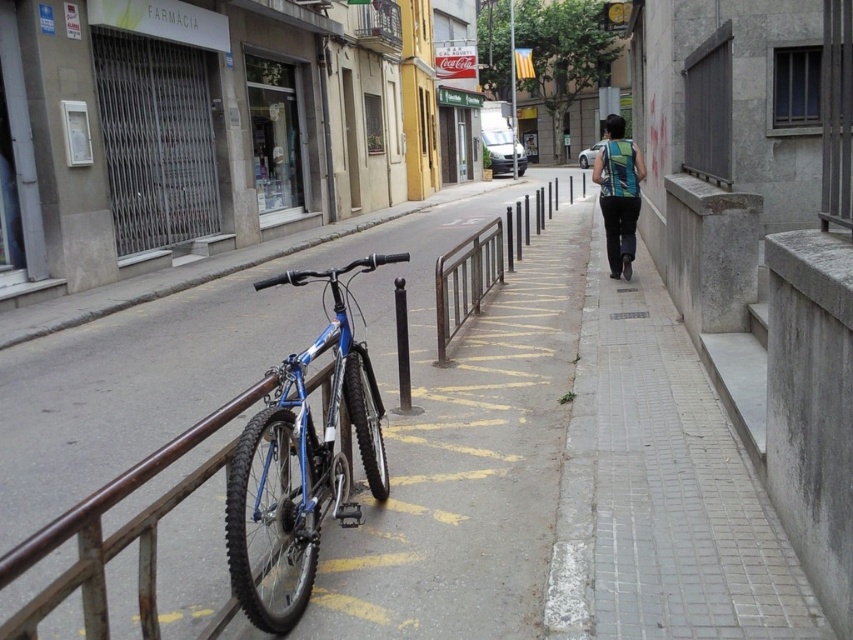
Measure the distance between point (151,480) and camera.

Point (151,480) and camera are 4.71 meters apart.

Which is in front, point (462, 637) or point (479, 275)?

Point (462, 637)

Image resolution: width=853 pixels, height=640 pixels. I want to click on smooth concrete pavement at center, so click(x=383, y=426).

Is blue metallic bicycle at left below green striped tank top at center?

Correct, blue metallic bicycle at left is located below green striped tank top at center.

Who is more forward, (280, 625) or (639, 164)?

Positioned in front is point (280, 625).

Describe the element at coordinates (305, 458) in the screenshot. This screenshot has width=853, height=640. I see `blue metallic bicycle at left` at that location.

The image size is (853, 640). Find the location of `blue metallic bicycle at left`. blue metallic bicycle at left is located at coordinates (x=305, y=458).

In the scene shown: Is smooth concrete pavement at center to the right of green striped tank top at center from the viewer's perspective?

Incorrect, smooth concrete pavement at center is not on the right side of green striped tank top at center.

Image resolution: width=853 pixels, height=640 pixels. Identify the location of smooth concrete pavement at center. (383, 426).